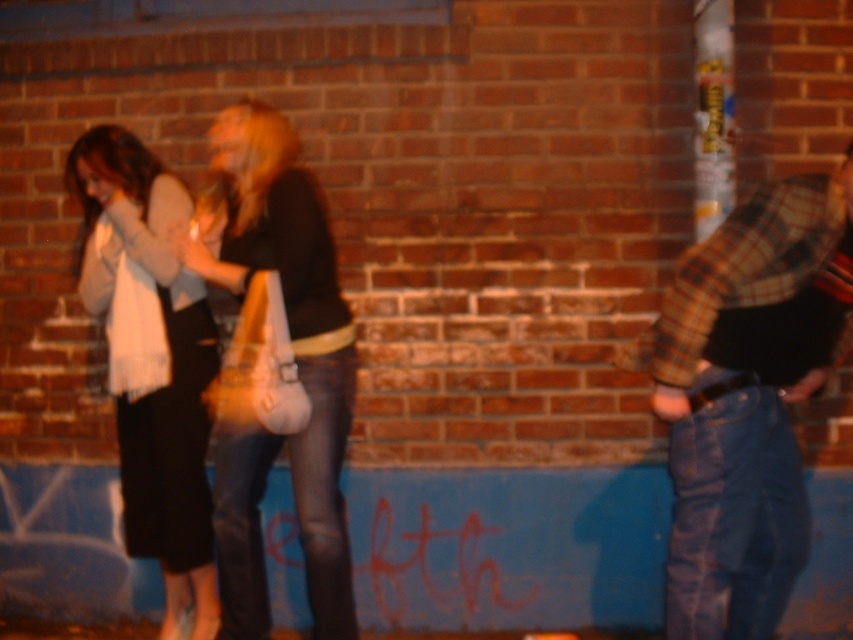
You are organizing a fashion show and need to place the matte white bag at center and the white scarf at left on a display table. Which item should you place closer to the front of the table to ensure both are visible?

The matte white bag at center is shorter than the white scarf at left, so to ensure visibility, place the matte white bag at center closer to the front of the table.

You are organizing a charity event and need to decide which item to place on a small table that can only hold one item. The plaid flannel shirt at right and the matte white bag at center are both candidates. Based on their sizes, which item would you choose to ensure it fits properly on the table?

The matte white bag at center should be chosen because the plaid flannel shirt at right is bigger than the matte white bag at center, making the bag more likely to fit on the small table.

You are a photographer trying to capture a closeup of the matte white bag at center and the white scarf at left. Which object should you focus on first if you want to ensure both are in focus without moving the camera?

You should focus on the matte white bag at center first because it is closer to the viewer than the white scarf at left, so adjusting focus from near to far will help both objects come into focus.